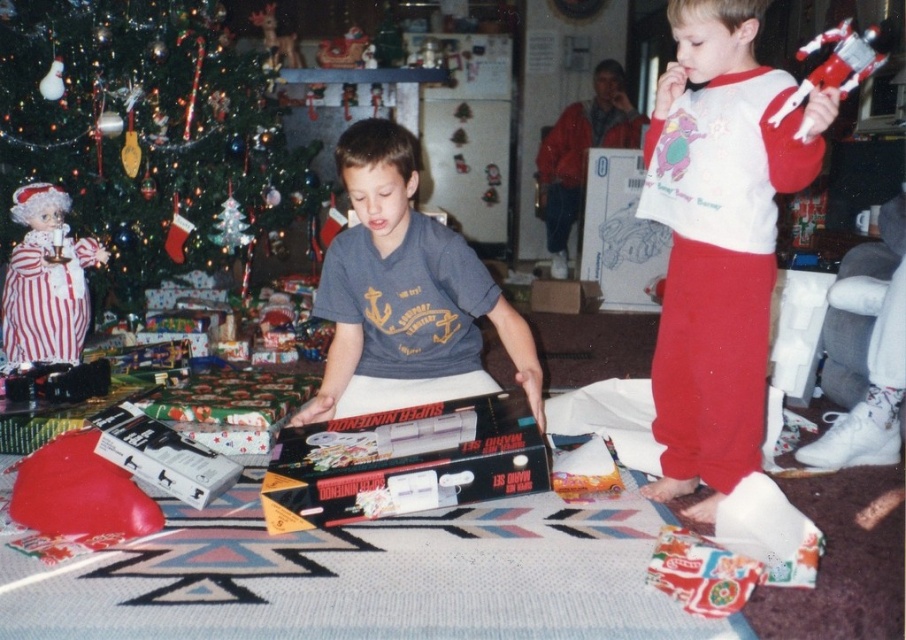
Does white cotton shirt at upper right appear on the left side of matte gray shirt at center?

No, white cotton shirt at upper right is not to the left of matte gray shirt at center.

Is point (689, 166) behind point (393, 282)?

That is False.

What do you see at coordinates (718, 240) in the screenshot? This screenshot has width=906, height=640. I see `white cotton shirt at upper right` at bounding box center [718, 240].

Locate an element on the screen. white cotton shirt at upper right is located at coordinates (718, 240).

Is white cotton shirt at upper right wider than black matte donkey kong game at center?

Incorrect, white cotton shirt at upper right's width does not surpass black matte donkey kong game at center's.

Between white cotton shirt at upper right and black matte donkey kong game at center, which one appears on the right side from the viewer's perspective?

Positioned to the right is white cotton shirt at upper right.

Which is in front, point (750, 410) or point (358, 477)?

Point (358, 477) is in front.

The width and height of the screenshot is (906, 640). Identify the location of white cotton shirt at upper right. (718, 240).

Does white matte video game console at lower left have a lesser width compared to red plastic robot at upper right?

In fact, white matte video game console at lower left might be wider than red plastic robot at upper right.

Which of these two, white matte video game console at lower left or red plastic robot at upper right, stands taller?

red plastic robot at upper right is taller.

Is point (127, 449) farther from camera compared to point (851, 77)?

Yes, point (127, 449) is farther from viewer.

Where is `white matte video game console at lower left`? white matte video game console at lower left is located at coordinates (162, 456).